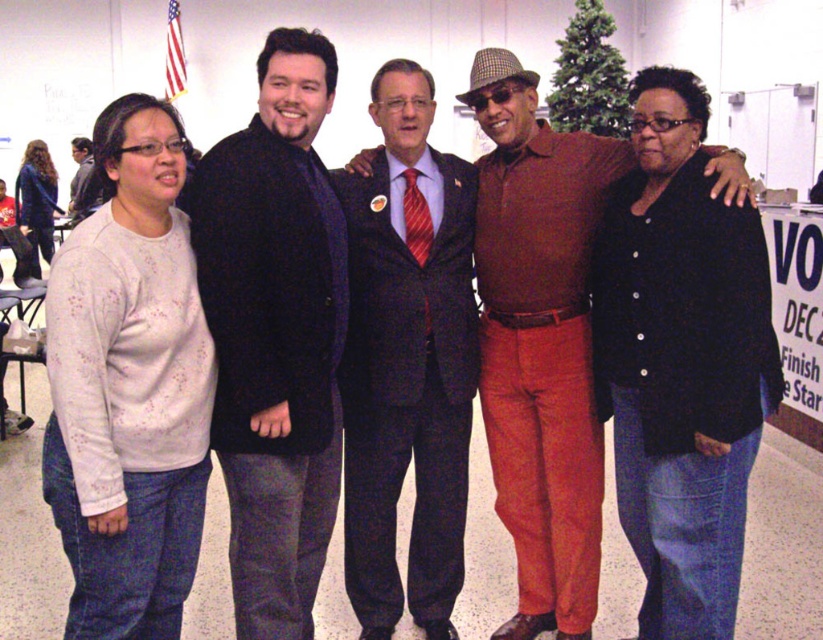
You are standing in the same room as the group and want to greet the person wearing the dark blue suit at center. Which direction should you move to approach them from the matte black sweater at left?

The dark blue suit at center is to the right of the matte black sweater at left, so you should move to the right to approach the dark blue suit at center from the matte black sweater at left.

You are organizing a photo shoot and need to arrange two people in a line for a group photo. You have a person wearing a white speckled sweater at left and another in a dark blue suit at center. According to the scene, which person should be placed to the left in the lineup?

The white speckled sweater at left should be placed to the left in the lineup because it is positioned on the left side of the dark blue suit at center in the original scene.

You are attending a community event and need to find the person wearing the dark blue suit at center. From the perspective of someone standing at the entrance facing the group, which direction should you look relative to the matte black sweater at left?

The dark blue suit at center is in front of the matte black sweater at left, so you should look forward towards the center area where the dark blue suit at center is positioned, rather than to the side of the matte black sweater at left.